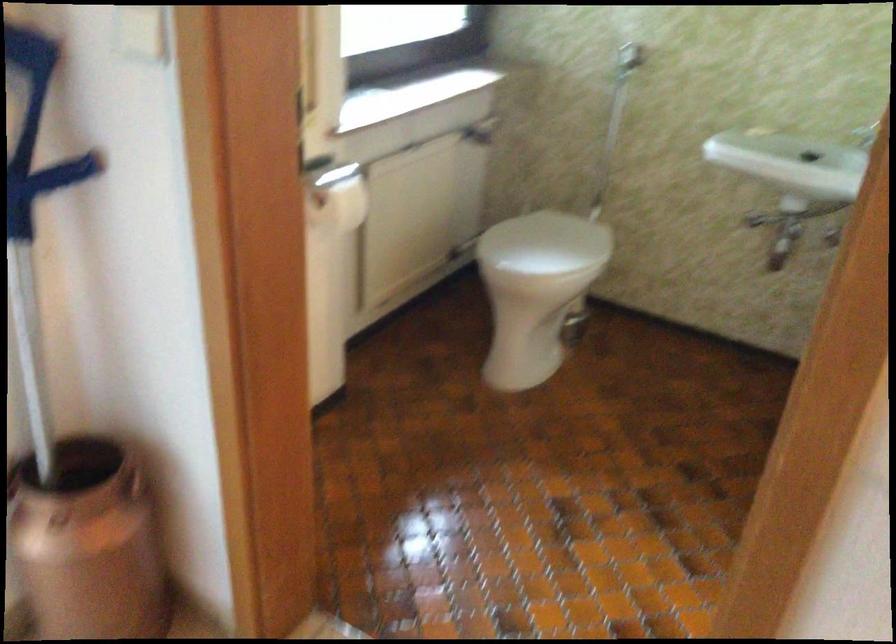
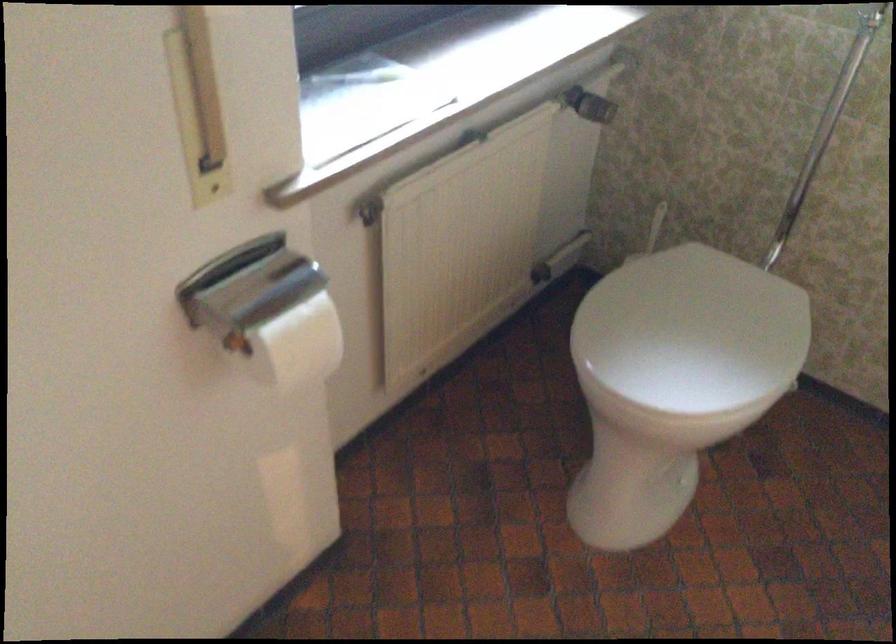
In the second image, find the point that corresponds to (x=546, y=245) in the first image.

(692, 330)